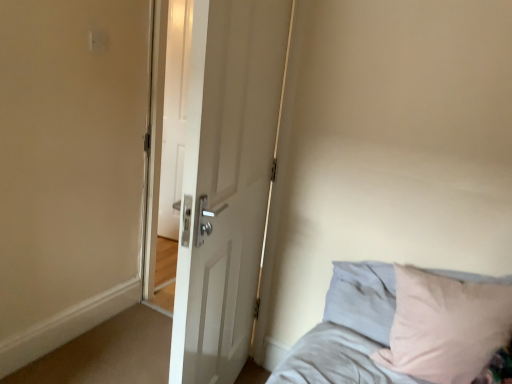
Question: In the image, is white matte door at center on the left side or the right side of light gray fabric bed at lower right?

Choices:
 (A) right
 (B) left

Answer: (B)

Question: In the image, is white matte door at center positioned in front of or behind light gray fabric bed at lower right?

Choices:
 (A) behind
 (B) front

Answer: (B)

Question: In terms of size, does white matte door at center appear bigger or smaller than light gray fabric bed at lower right?

Choices:
 (A) small
 (B) big

Answer: (B)

Question: Based on their positions, is light gray fabric bed at lower right located to the left or right of white matte door at center?

Choices:
 (A) right
 (B) left

Answer: (A)

Question: From the image's perspective, is light gray fabric bed at lower right positioned above or below white matte door at center?

Choices:
 (A) above
 (B) below

Answer: (B)

Question: Is light gray fabric bed at lower right in front of or behind white matte door at center in the image?

Choices:
 (A) behind
 (B) front

Answer: (A)

Question: Which is correct: light gray fabric bed at lower right is inside white matte door at center, or outside of it?

Choices:
 (A) outside
 (B) inside

Answer: (A)